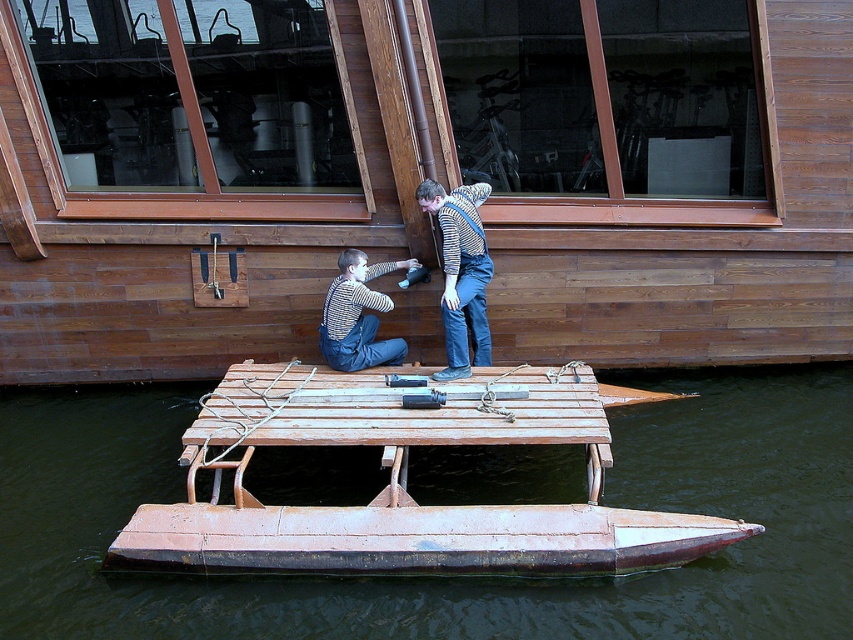
From the picture: You are designing a storage container for the wooden at center and striped fabric overalls at center. Given their widths, which object requires a wider container for storage?

The wooden at center requires a wider container because its width surpasses that of the striped fabric overalls at center.

You are a visitor at a lake and see the wooden at center and the striped fabric overalls at center. Which object takes up more space in the image?

The wooden at center takes up more space in the image because it is bigger than the striped fabric overalls at center.